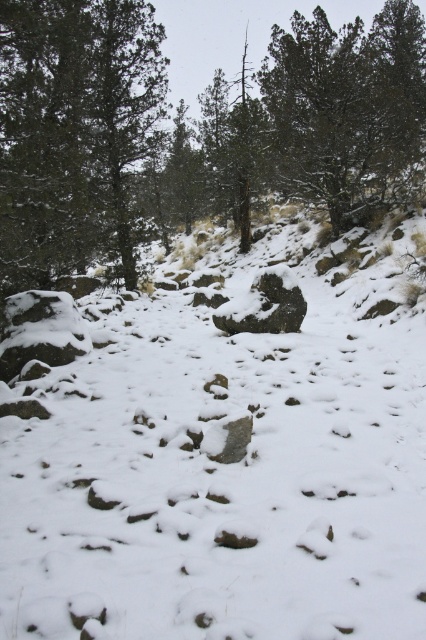
Looking at this image, you are standing in the snowy landscape and want to walk towards the dark green textured tree at upper right. Which direction should you head to avoid the green matte tree at upper left?

To reach the dark green textured tree at upper right while avoiding the green matte tree at upper left, head towards the right side of the scene since the green matte tree at upper left is located to the left of the dark green textured tree at upper right.

You are planning to build a snowman using objects in the scene. The snowman requires a base that is larger than the middle section. Can you use the green matte tree at upper left and the dark gray rock at center for this purpose?

The green matte tree at upper left is bigger than the dark gray rock at center. Since the snowman requires a base larger than the middle section, you can use the green matte tree at upper left as the base and the dark gray rock at center as the middle section.